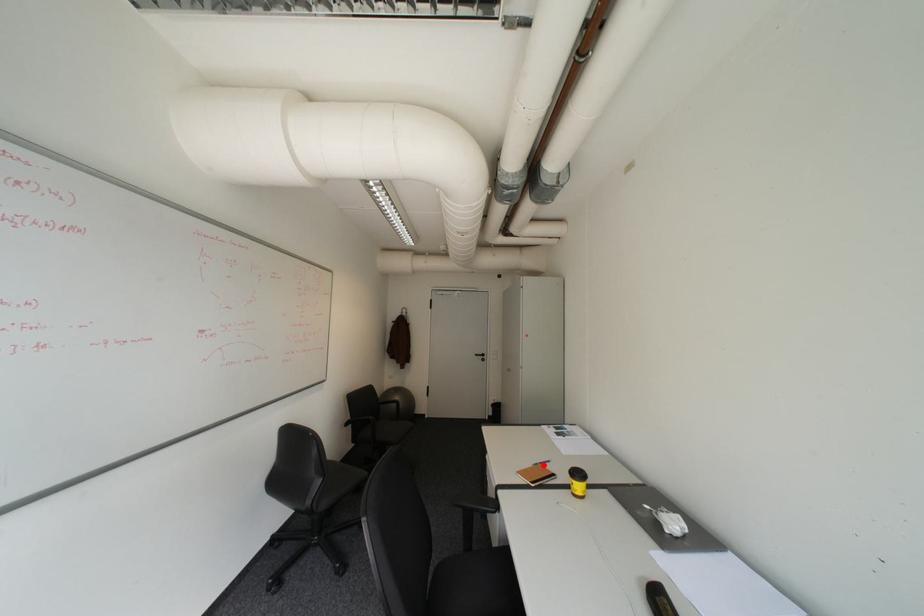
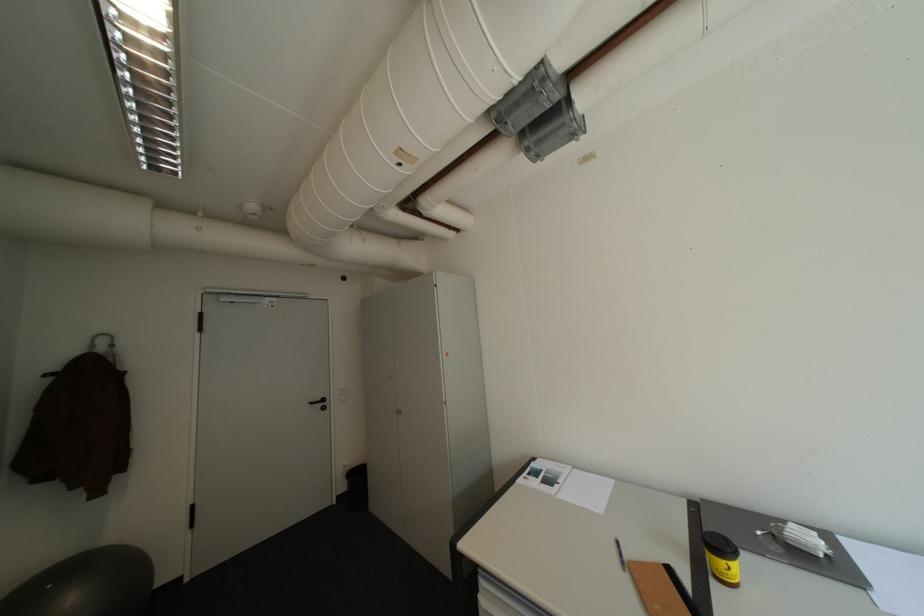
In the second image, find the point that corresponds to the highlighted location in the first image.

(634, 570)